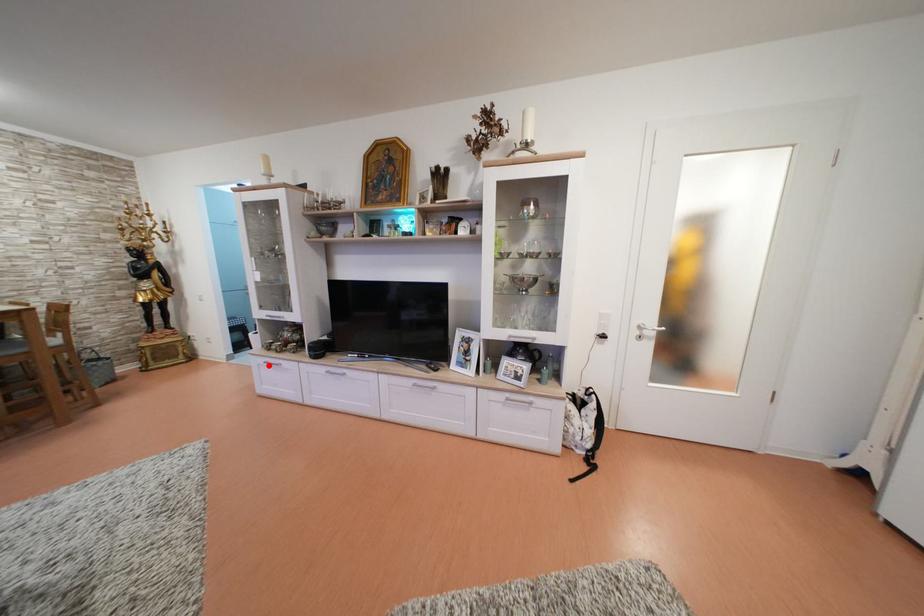
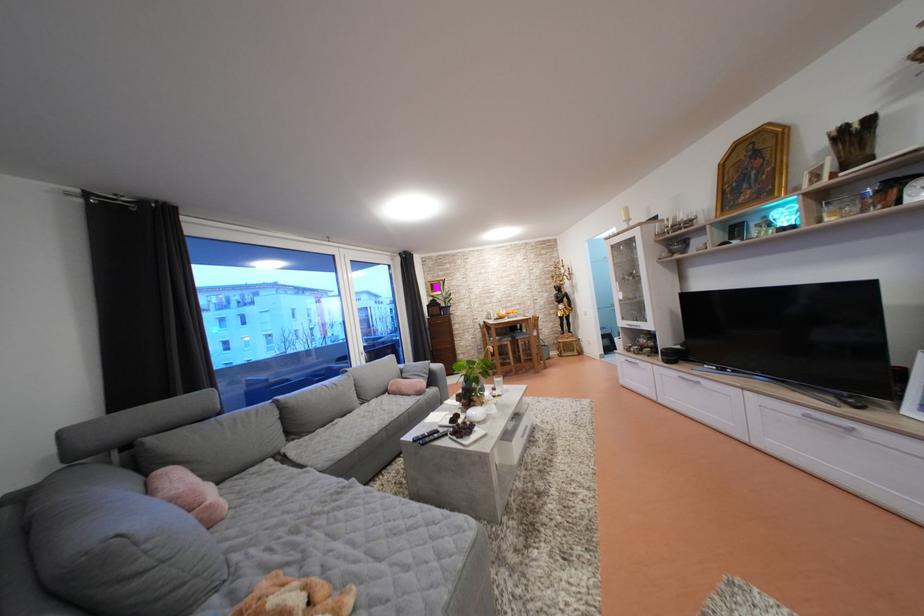
Find the pixel in the second image that matches the highlighted location in the first image.

(630, 363)